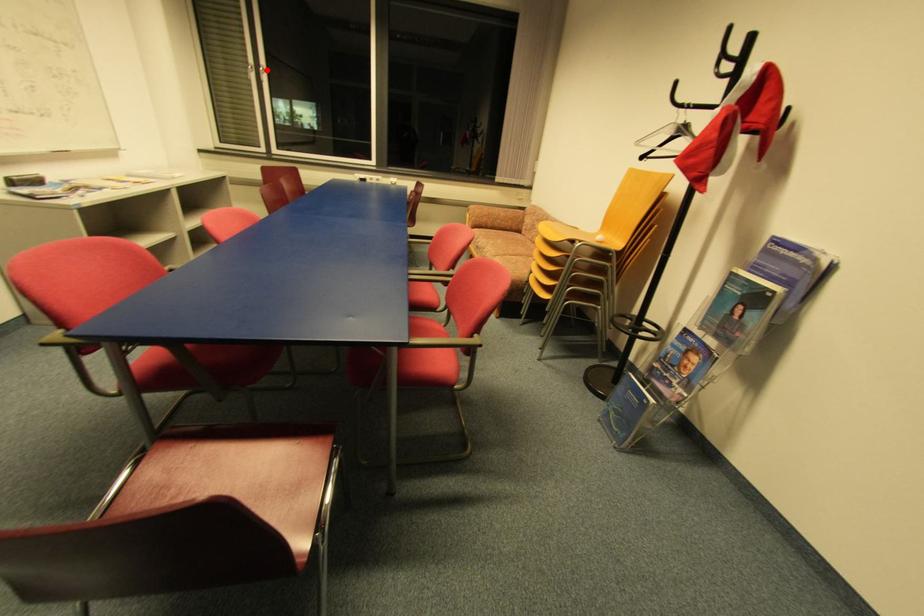
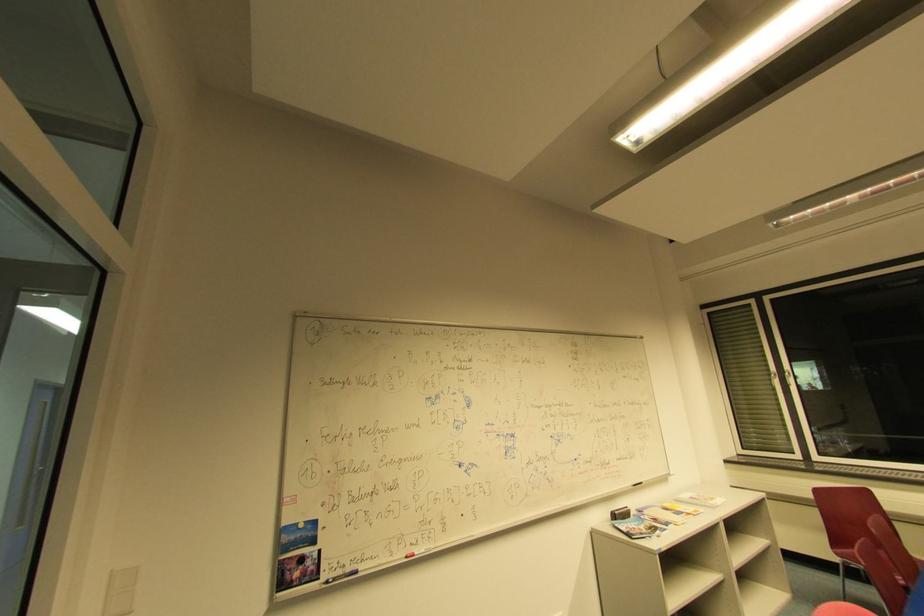
The point at the highlighted location is marked in the first image. Where is the corresponding point in the second image?

(791, 375)